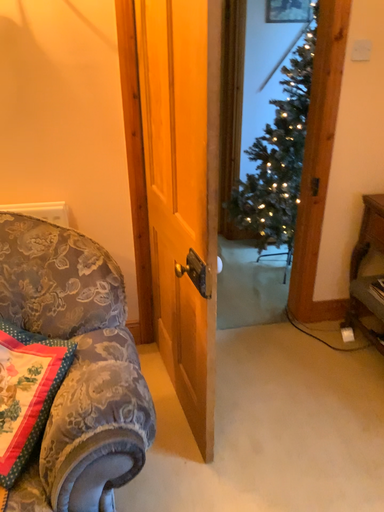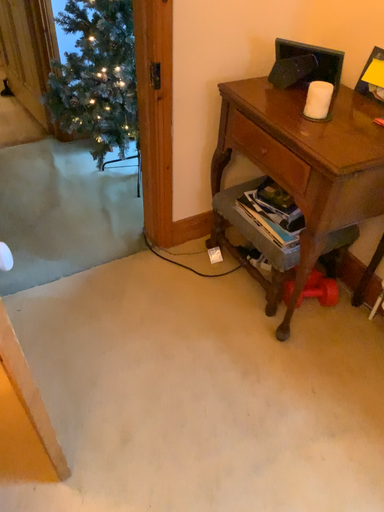
Question: How did the camera likely rotate when shooting the video?

Choices:
 (A) rotated downward
 (B) rotated upward

Answer: (A)